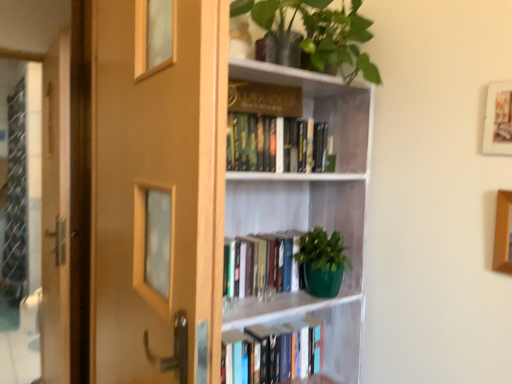
Question: Considering the relative positions of hardcover books at upper center, which is counted as the second book, starting from the top, and wooden screen door at left in the image provided, is hardcover books at upper center, which is counted as the second book, starting from the top, in front of wooden screen door at left?

Choices:
 (A) no
 (B) yes

Answer: (B)

Question: Considering the relative sizes of hardcover books at upper center, which is counted as the second book, starting from the top, and wooden screen door at left in the image provided, is hardcover books at upper center, which is counted as the second book, starting from the top, shorter than wooden screen door at left?

Choices:
 (A) yes
 (B) no

Answer: (A)

Question: From the image's perspective, does hardcover books at upper center, which is the 3th book in bottom-to-top order, appear higher than wooden screen door at left?

Choices:
 (A) no
 (B) yes

Answer: (B)

Question: Is hardcover books at upper center, which is counted as the second book, starting from the top, wider than wooden screen door at left?

Choices:
 (A) no
 (B) yes

Answer: (A)

Question: From a real-world perspective, is hardcover books at upper center, which is the 3th book in bottom-to-top order, beneath wooden screen door at left?

Choices:
 (A) yes
 (B) no

Answer: (B)

Question: Does hardcover books at upper center, which is counted as the second book, starting from the top, have a smaller size compared to wooden screen door at left?

Choices:
 (A) yes
 (B) no

Answer: (A)

Question: Is green matte book at center, which is the 3th book from top to bottom, positioned beyond the bounds of wooden door at left?

Choices:
 (A) yes
 (B) no

Answer: (A)

Question: From the image's perspective, is green matte book at center, which is counted as the 2th book, starting from the bottom, on wooden door at left?

Choices:
 (A) yes
 (B) no

Answer: (B)

Question: Is green matte book at center, which is the 3th book from top to bottom, beside wooden door at left?

Choices:
 (A) no
 (B) yes

Answer: (A)

Question: Is green matte book at center, which is the 3th book from top to bottom, facing towards wooden door at left?

Choices:
 (A) no
 (B) yes

Answer: (A)

Question: Considering the relative sizes of green matte book at center, which is the 3th book from top to bottom, and wooden door at left in the image provided, is green matte book at center, which is the 3th book from top to bottom, shorter than wooden door at left?

Choices:
 (A) yes
 (B) no

Answer: (A)

Question: Considering the relative sizes of green matte book at center, which is counted as the 2th book, starting from the bottom, and wooden door at left in the image provided, is green matte book at center, which is counted as the 2th book, starting from the bottom, wider than wooden door at left?

Choices:
 (A) yes
 (B) no

Answer: (A)

Question: Is wooden picture frame at upper right, placed as the 2th picture frame when sorted from top to bottom, in contact with hardcover book at center, acting as the 1th book starting from the bottom?

Choices:
 (A) no
 (B) yes

Answer: (A)